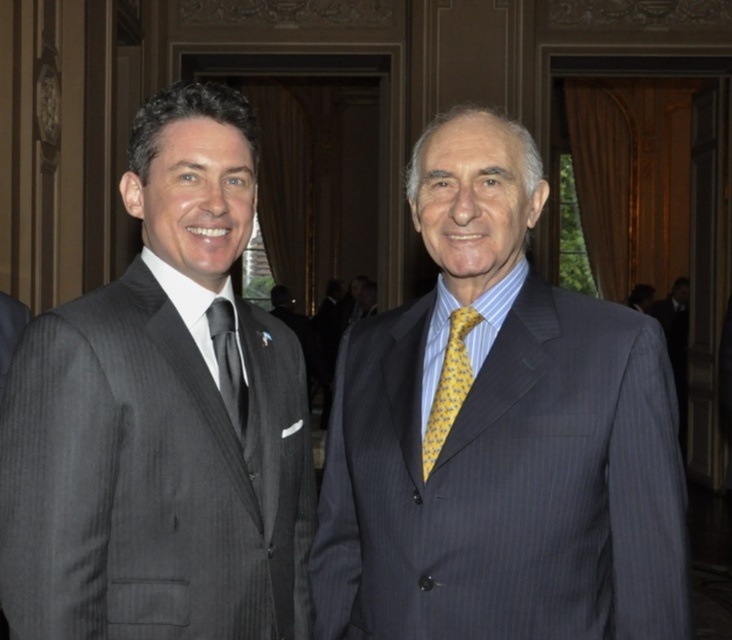
You are a photographer at a formal event. You need to arrange two men in suits so that their suits are visible in the photo. The men are wearing the matte gray suit at center and the matte black suit at left. Which suit should be positioned closer to the camera to ensure both suits are fully visible in the photo?

The matte gray suit at center is not as tall as the matte black suit at left, so positioning the shorter matte gray suit at center closer to the camera will ensure both suits are fully visible in the photo.